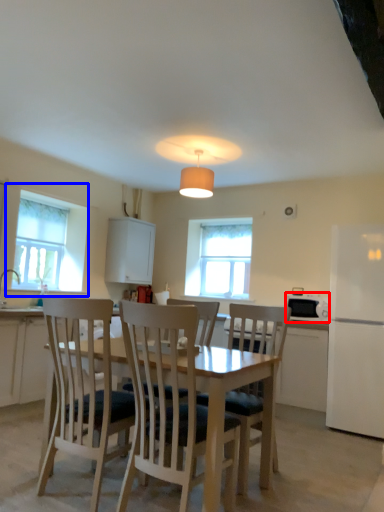
Question: Which object is closer to the camera taking this photo, appliance (highlighted by a red box) or window (highlighted by a blue box)?

Choices:
 (A) appliance
 (B) window

Answer: (A)